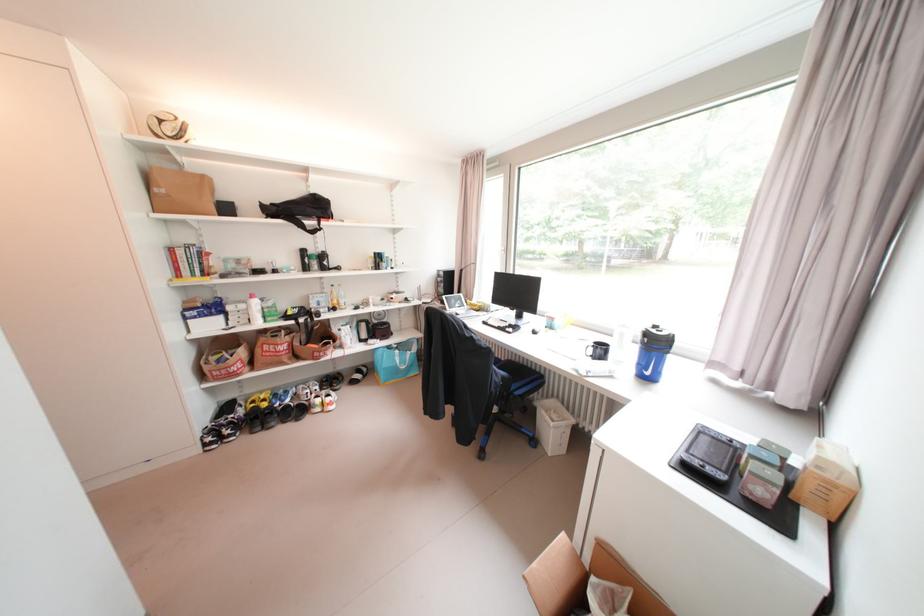
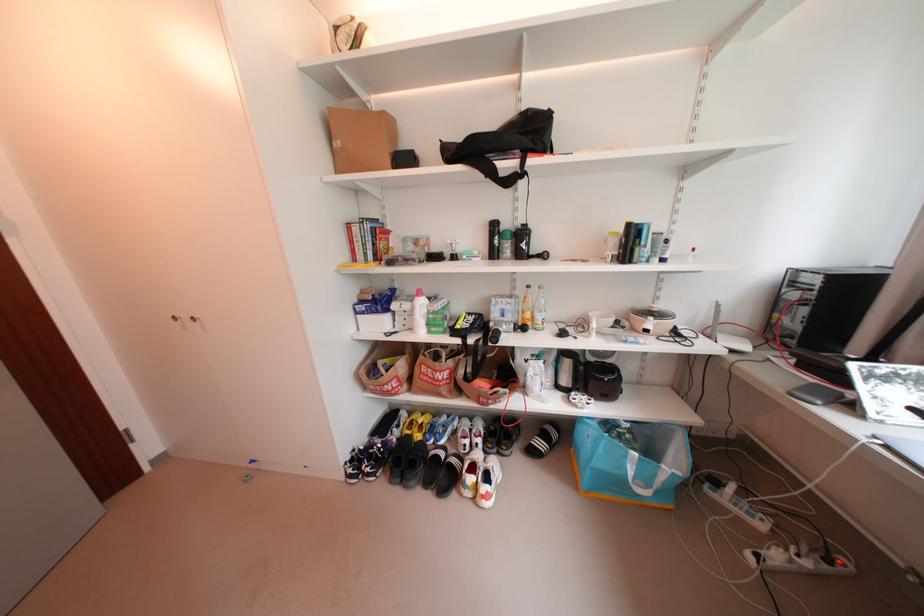
Where in the second image is the point corresponding to pixel 164 191 from the first image?

(343, 145)